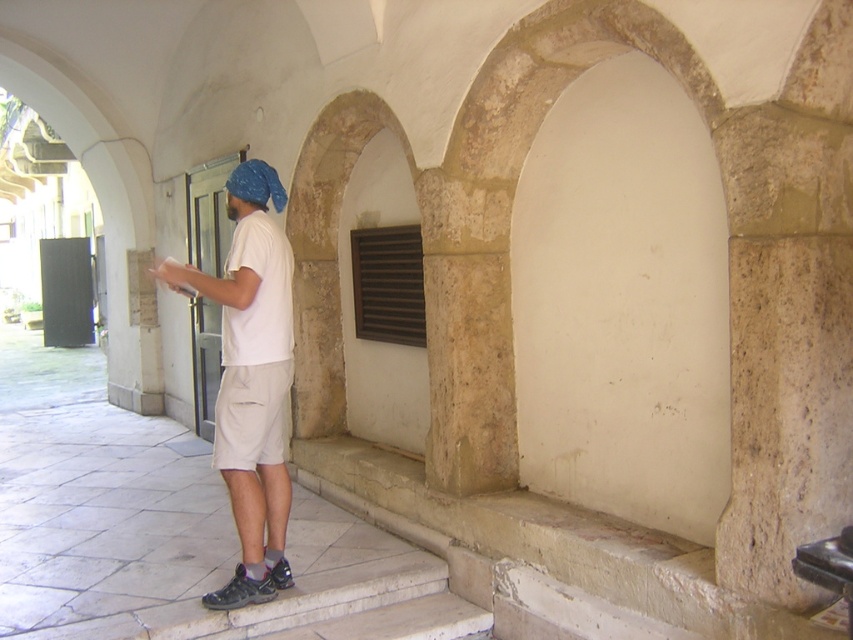
Who is lower down, white matte shirt at center or blue fabric headscarf at upper left?

Positioned lower is white matte shirt at center.

Between white matte shirt at center and blue fabric headscarf at upper left, which one appears on the right side from the viewer's perspective?

From the viewer's perspective, white matte shirt at center appears more on the right side.

Is point (230, 340) more distant than point (238, 168)?

That is False.

The image size is (853, 640). I want to click on white matte shirt at center, so click(x=259, y=294).

Which of these two, white cotton shirt at center or beige cotton shorts at center, stands shorter?

beige cotton shorts at center is shorter.

Which is below, white cotton shirt at center or beige cotton shorts at center?

beige cotton shorts at center is lower down.

You are a GUI agent. You are given a task and a screenshot of the screen. Output one action in this format:
    pyautogui.click(x=<x>, y=<y>)
    Task: Click on the white cotton shirt at center
    Image resolution: width=853 pixels, height=640 pixels.
    Given the screenshot: What is the action you would take?
    pyautogui.click(x=251, y=380)

Find the location of `white cotton shirt at center`. white cotton shirt at center is located at coordinates (251, 380).

Is white matte shirt at center below beige cotton shorts at center?

No.

Which is more to the left, white matte shirt at center or beige cotton shorts at center?

white matte shirt at center

Who is more distant from viewer, (263, 214) or (219, 376)?

Point (219, 376)

Locate an element on the screen. Image resolution: width=853 pixels, height=640 pixels. white matte shirt at center is located at coordinates 259,294.